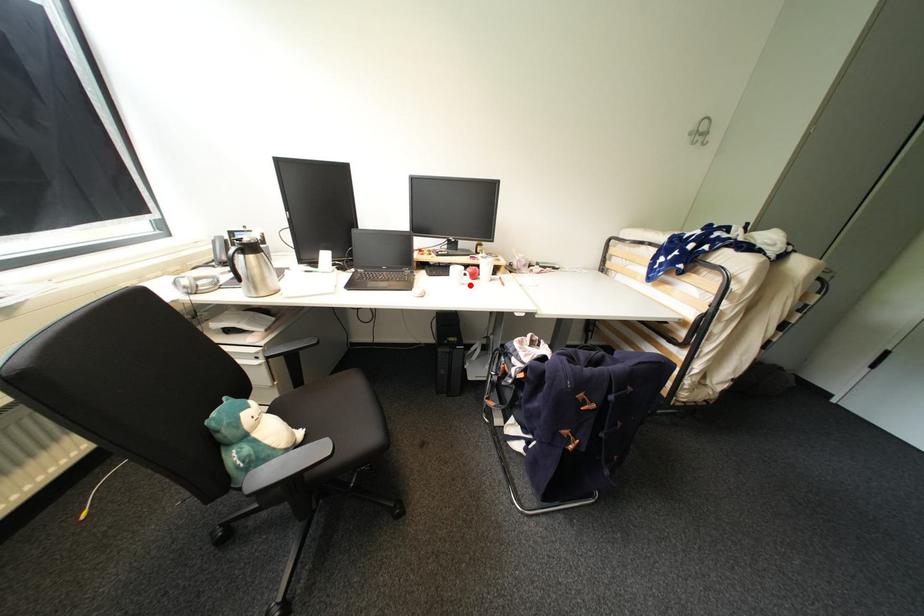
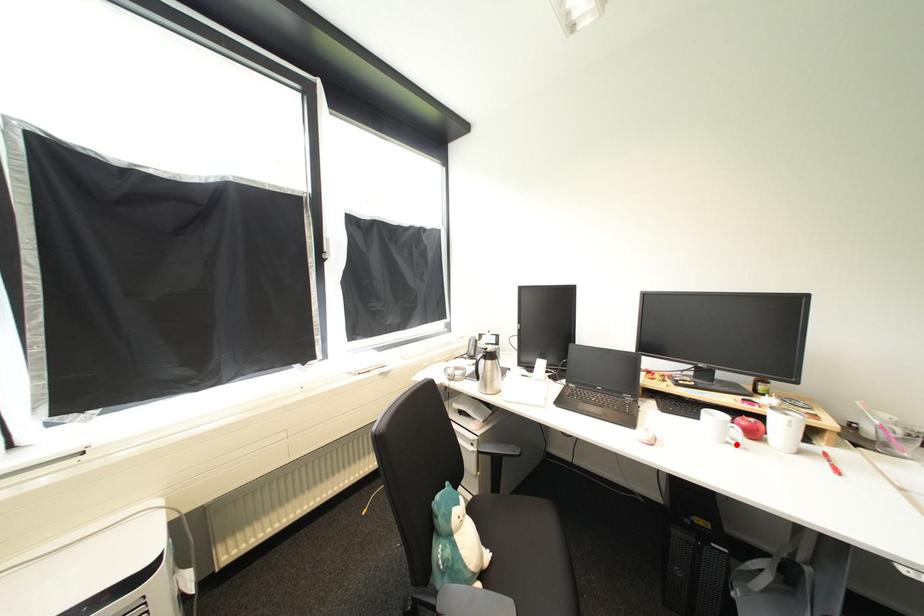
I am providing you with two images of the same scene from different viewpoints. A red point is marked on the first image and another point is marked on the second image. Does the point marked in image1 correspond to the same location as the one in image2?

Yes